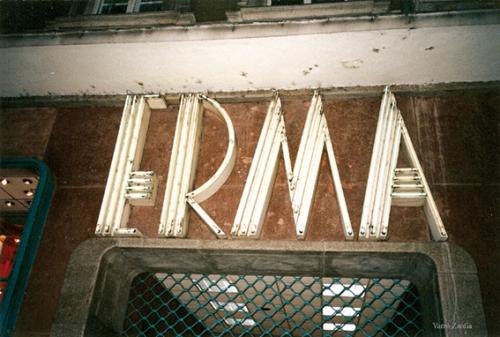
The width and height of the screenshot is (500, 337). Find the location of `windowsill`. windowsill is located at coordinates (114, 18).